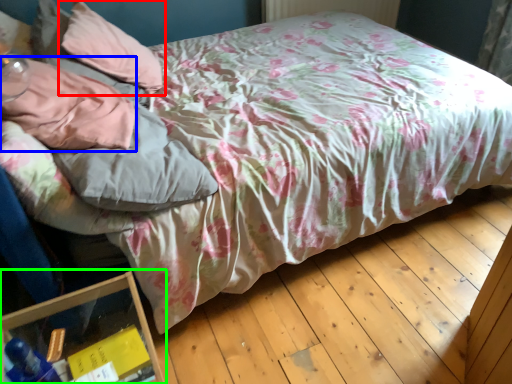
Question: Which object is positioned farthest from pillow (highlighted by a red box)? Select from pillow (highlighted by a blue box) and glass box (highlighted by a green box).

Choices:
 (A) pillow
 (B) glass box

Answer: (B)